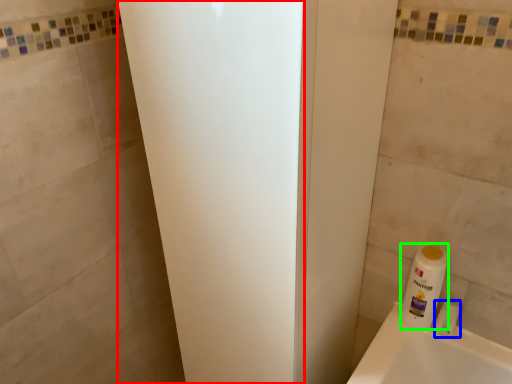
Question: Based on their relative distances, which object is nearer to screen door (highlighted by a red box)? Choose from toiletry (highlighted by a blue box) and cleaning product (highlighted by a green box).

Choices:
 (A) toiletry
 (B) cleaning product

Answer: (B)